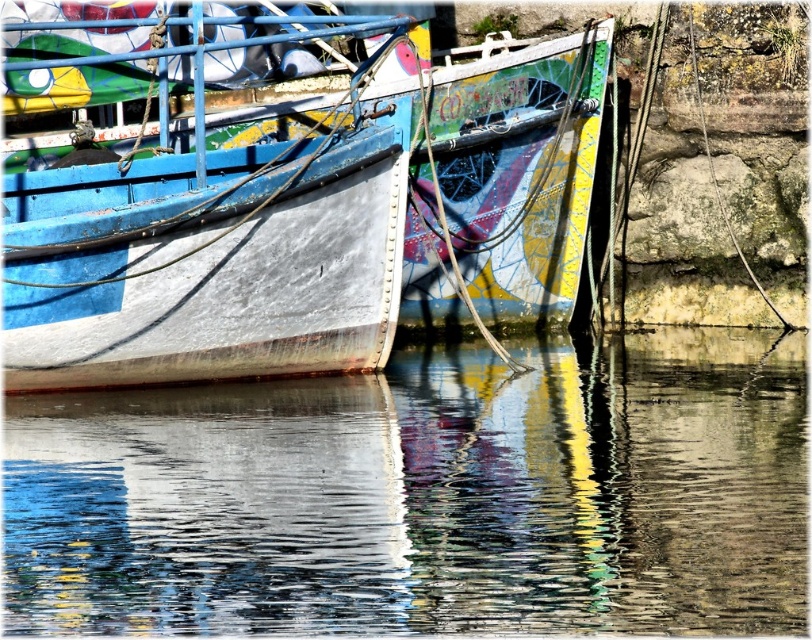
You are a sailor standing on the deck of the rusty metal boat at left and want to jump into the glossy water at lower center. Can you safely make the jump if your maximum jump distance is 3 meters?

The distance between the glossy water at lower center and the rusty metal boat at left is 3.81 meters, which exceeds your maximum jump distance of 3 meters. Therefore, you cannot safely make the jump.

You are standing at the edge of the dock and want to take a photo of the boat. The glossy water at lower center is reflecting the boat. Where should you position yourself to ensure the reflection is centered in your photo?

To center the reflection of the boat in your photo, position yourself directly above the glossy water at lower center, which is located at coordinates approximately 0.777 on the x and 0.523 on the y axis.